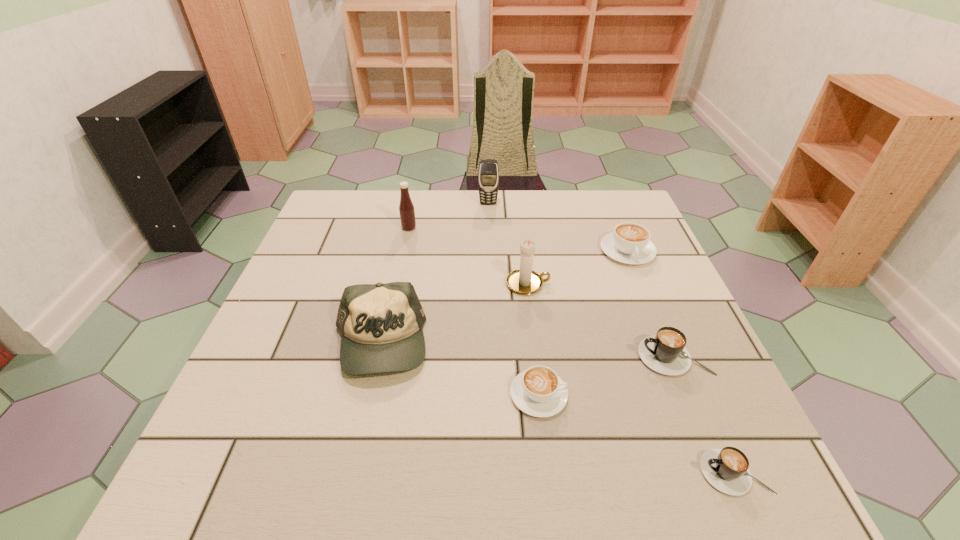
Find the location of a particular element. The height and width of the screenshot is (540, 960). object located at the near edge is located at coordinates (726, 469).

The width and height of the screenshot is (960, 540). Find the location of `object present at the left edge`. object present at the left edge is located at coordinates (381, 325).

The height and width of the screenshot is (540, 960). I want to click on object that is at the far right corner, so click(629, 243).

Find the location of a particular element. object situated at the near right corner is located at coordinates (726, 469).

In the image, there is a desktop. Identify the location of free space at the far edge. This screenshot has width=960, height=540. (475, 228).

At what (x,y) coordinates should I click in order to perform the action: click on free space at the near edge of the desktop. Please return your answer as a coordinate pair (x, y). This screenshot has height=540, width=960. Looking at the image, I should click on (378, 463).

Locate an element on the screen. vacant region at the left edge is located at coordinates (285, 297).

The image size is (960, 540). What are the coordinates of `vacant space at the right edge` in the screenshot? It's located at (710, 353).

At what (x,y) coordinates should I click in order to perform the action: click on free space at the far left corner. Please return your answer as a coordinate pair (x, y). This screenshot has width=960, height=540. Looking at the image, I should click on (345, 201).

Locate an element on the screen. This screenshot has width=960, height=540. free space at the far right corner is located at coordinates (595, 204).